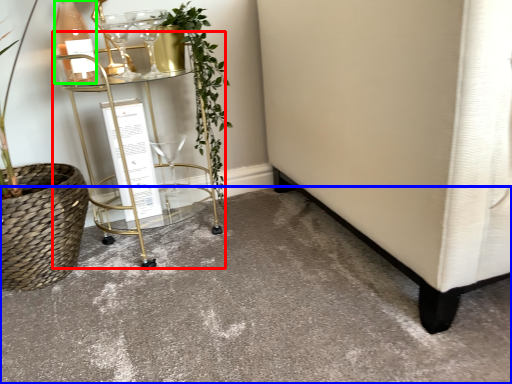
Question: Based on their relative distances, which object is farther from table (highlighted by a red box)? Choose from concrete (highlighted by a blue box) and bottle (highlighted by a green box).

Choices:
 (A) concrete
 (B) bottle

Answer: (A)